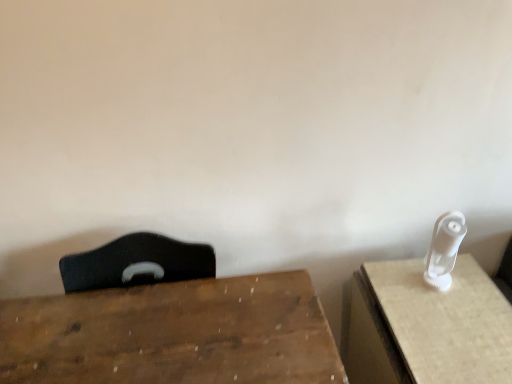
The image size is (512, 384). I want to click on free space above white plastic toothbrush at right, placed as the 1th table when sorted from right to left (from a real-world perspective), so click(444, 310).